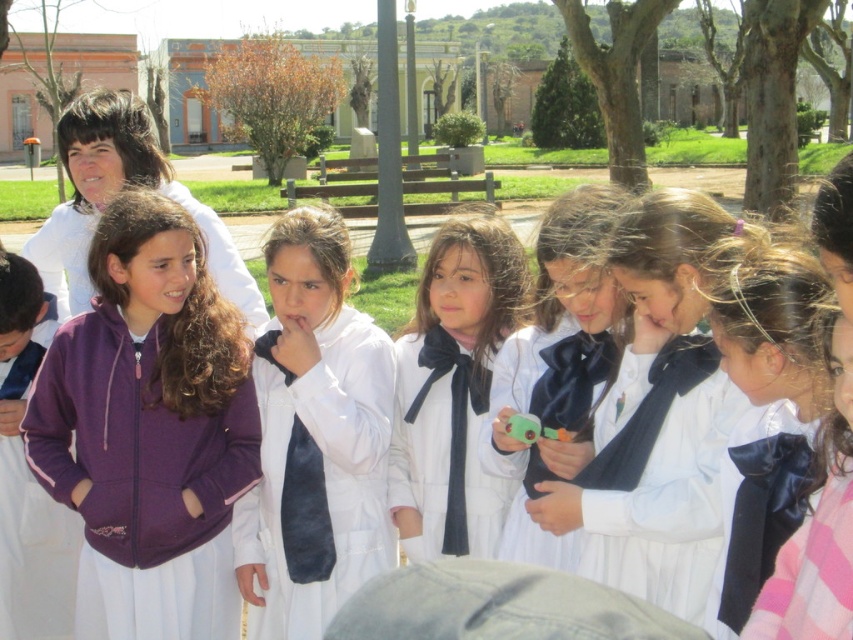
Question: Can you confirm if matte black bow tie at center is smaller than matte black tie at center?

Choices:
 (A) yes
 (B) no

Answer: (A)

Question: Which object is positioned farthest from the matte black tie at center?

Choices:
 (A) black velvet tie at center
 (B) velvet black tie at center

Answer: (A)

Question: Among these objects, which one is farthest from the camera?

Choices:
 (A) white matte uniform at center
 (B) matte black bow tie at center
 (C) black velvet tie at center
 (D) matte black tie at center

Answer: (D)

Question: Estimate the real-world distances between objects in this image. Which object is farther from the white matte uniform at center?

Choices:
 (A) black velvet tie at center
 (B) velvet black tie at center
 (C) purple fleece jacket at left

Answer: (B)

Question: Does purple fleece jacket at left appear on the left side of matte black tie at center?

Choices:
 (A) no
 (B) yes

Answer: (B)

Question: Is the position of matte black tie at center less distant than that of black satin tie at center?

Choices:
 (A) yes
 (B) no

Answer: (B)